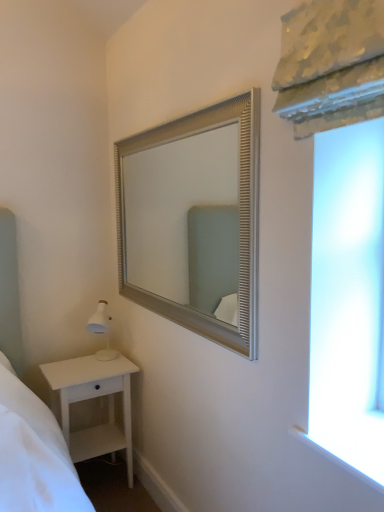
Question: Should I look upward or downward to see white matte nightstand at lower left?

Choices:
 (A) up
 (B) down

Answer: (B)

Question: Is silver textured mirror at upper center at the left side of white matte nightstand at lower left?

Choices:
 (A) yes
 (B) no

Answer: (B)

Question: Does silver textured mirror at upper center contain white matte nightstand at lower left?

Choices:
 (A) no
 (B) yes

Answer: (A)

Question: Would you say silver textured mirror at upper center is a long distance from white matte nightstand at lower left?

Choices:
 (A) no
 (B) yes

Answer: (A)

Question: From a real-world perspective, is silver textured mirror at upper center located beneath white matte nightstand at lower left?

Choices:
 (A) yes
 (B) no

Answer: (B)

Question: Considering the relative sizes of silver textured mirror at upper center and white matte nightstand at lower left in the image provided, is silver textured mirror at upper center bigger than white matte nightstand at lower left?

Choices:
 (A) no
 (B) yes

Answer: (A)

Question: Are silver textured mirror at upper center and white matte nightstand at lower left making contact?

Choices:
 (A) yes
 (B) no

Answer: (B)

Question: From a real-world perspective, is white matte nightstand at lower left on silver textured mirror at upper center?

Choices:
 (A) yes
 (B) no

Answer: (B)

Question: Is white matte nightstand at lower left in front of silver textured mirror at upper center?

Choices:
 (A) no
 (B) yes

Answer: (A)

Question: From the image's perspective, does white matte nightstand at lower left appear lower than silver textured mirror at upper center?

Choices:
 (A) yes
 (B) no

Answer: (A)

Question: Is white matte nightstand at lower left to the left of silver textured mirror at upper center from the viewer's perspective?

Choices:
 (A) yes
 (B) no

Answer: (A)

Question: Can you confirm if white matte nightstand at lower left is taller than silver textured mirror at upper center?

Choices:
 (A) no
 (B) yes

Answer: (A)

Question: Can you confirm if white matte nightstand at lower left is wider than silver textured mirror at upper center?

Choices:
 (A) yes
 (B) no

Answer: (A)

Question: Does point (130, 463) appear closer or farther from the camera than point (139, 262)?

Choices:
 (A) closer
 (B) farther

Answer: (A)